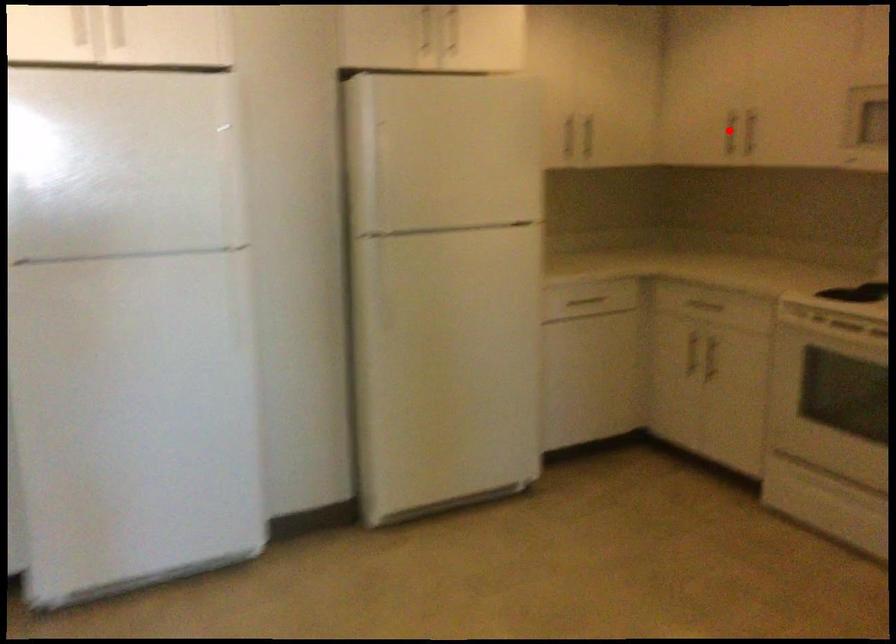
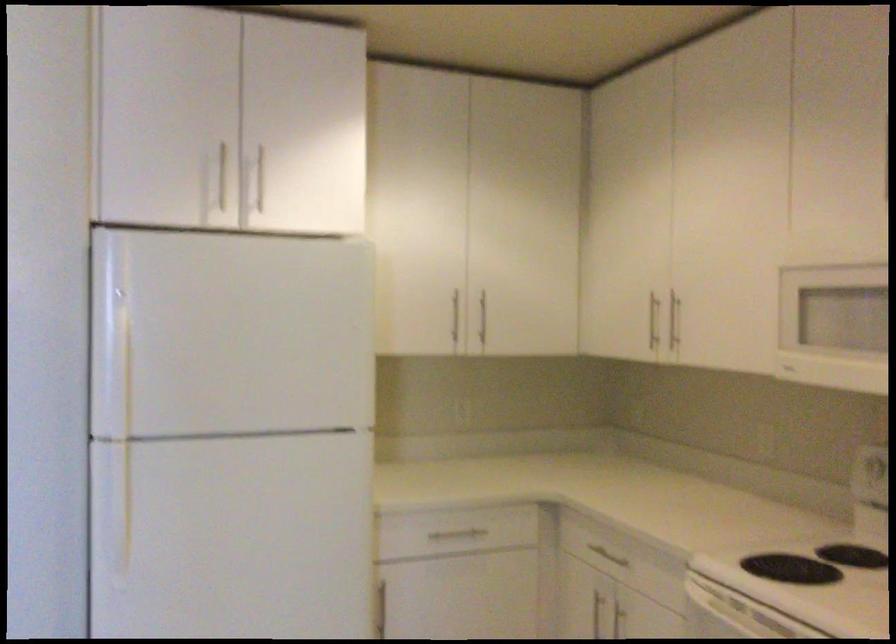
Where in the second image is the point corresponding to the highlighted location from the first image?

(652, 321)